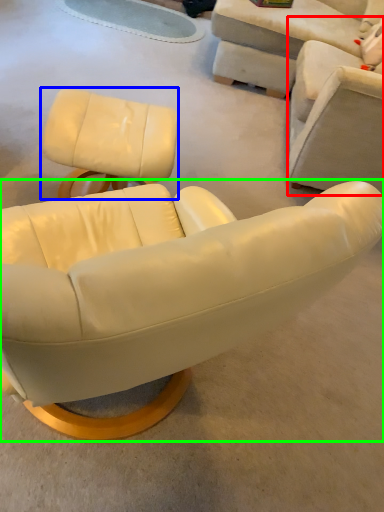
Question: Which object is positioned farthest from chair (highlighted by a red box)? Select from chair (highlighted by a blue box) and chair (highlighted by a green box).

Choices:
 (A) chair
 (B) chair

Answer: (B)